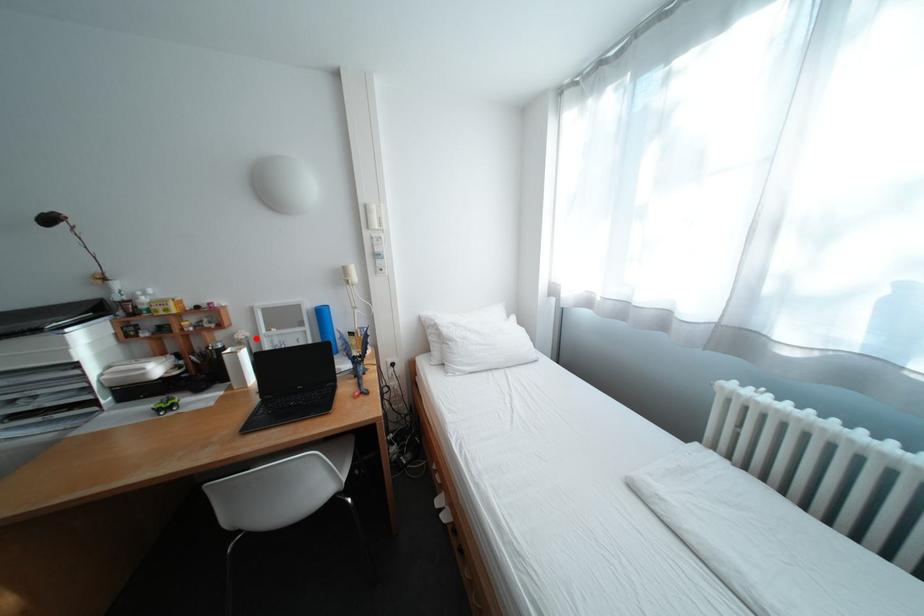
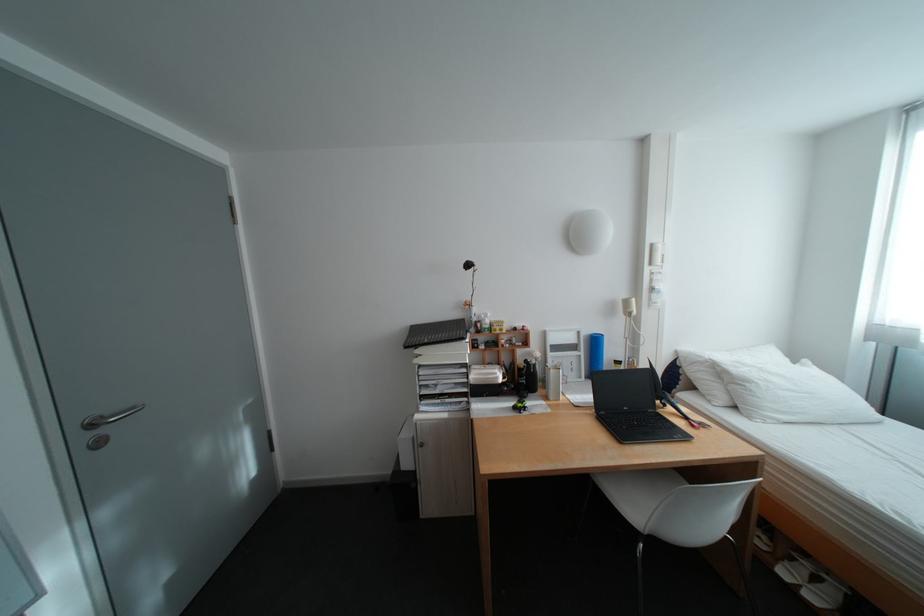
Question: I am providing you with two images of the same scene from different viewpoints. A red point is marked on the first image. At the location where the point appears in image 1, is it still visible in image 2?

Choices:
 (A) Yes
 (B) No

Answer: (A)